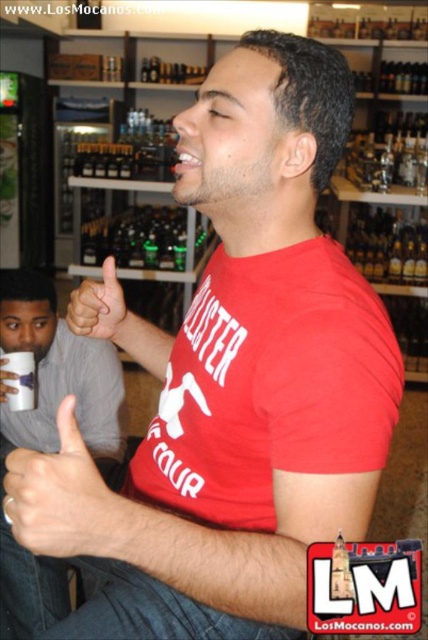
From the picture: Is skinny metallic ring at upper center bigger than matte red thumb at center?

Incorrect, skinny metallic ring at upper center is not larger than matte red thumb at center.

In the scene shown: Is skinny metallic ring at upper center smaller than matte red thumb at center?

Correct, skinny metallic ring at upper center occupies less space than matte red thumb at center.

At what (x,y) coordinates should I click in order to perform the action: click on skinny metallic ring at upper center. Please return your answer as a coordinate pair (x, y). The height and width of the screenshot is (640, 428). Looking at the image, I should click on (59, 496).

Where is `skinny metallic ring at upper center`? The width and height of the screenshot is (428, 640). skinny metallic ring at upper center is located at coordinates 59,496.

Can you confirm if gray fabric shirt at left is wider than matte red thumb at center?

Yes.

Measure the distance between gray fabric shirt at left and matte red thumb at center.

gray fabric shirt at left is 21.93 inches away from matte red thumb at center.

Who is more forward, (5, 324) or (122, 308)?

Positioned in front is point (122, 308).

Identify the location of gray fabric shirt at left. (58, 372).

Does matte red thumb at center appear on the right side of white matte cup at lower left?

Indeed, matte red thumb at center is positioned on the right side of white matte cup at lower left.

Is point (125, 339) closer to viewer compared to point (15, 392)?

Yes, it is.

You are a GUI agent. You are given a task and a screenshot of the screen. Output one action in this format:
    pyautogui.click(x=<x>, y=<y>)
    Task: Click on the matte red thumb at center
    
    Given the screenshot: What is the action you would take?
    pyautogui.click(x=101, y=308)